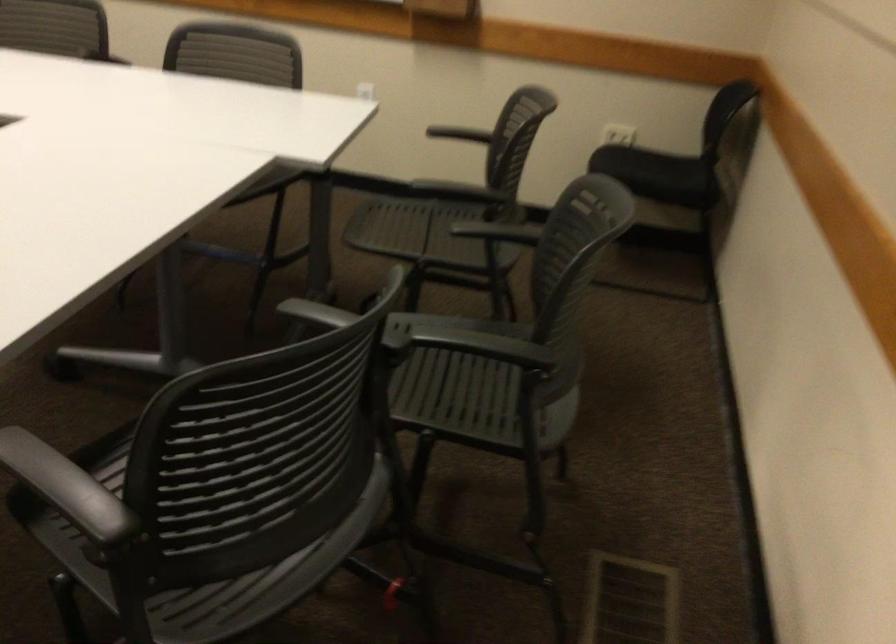
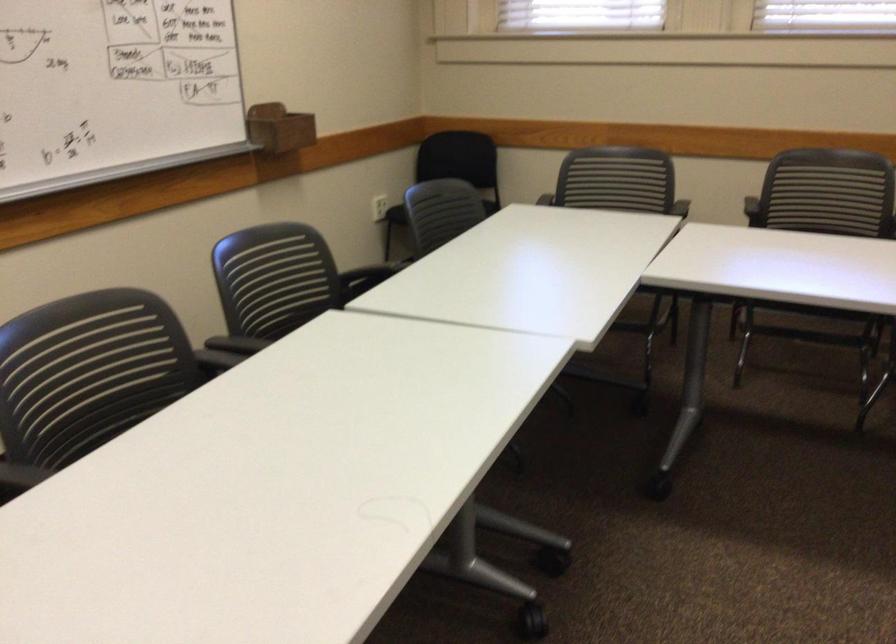
Question: I am providing you with two images of the same scene from different viewpoints. Please identify which objects are invisible in image2.

Choices:
 (A) wooden marker holder
 (B) white router antenna
 (C) chair sitting surface
 (D) black chair armrest

Answer: (D)